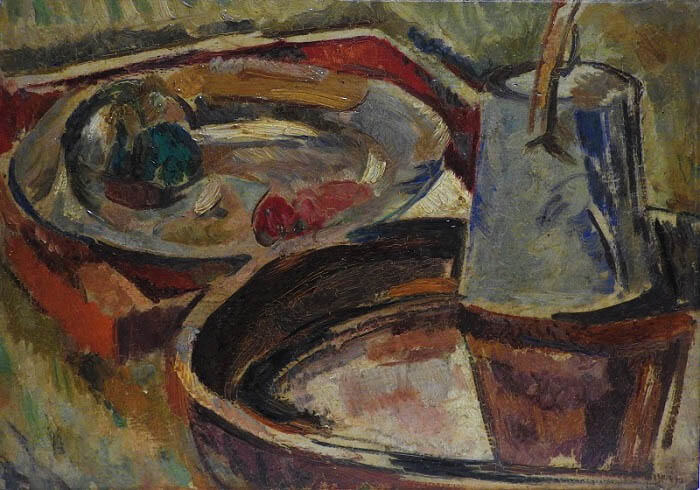
I want to click on plate, so click(x=68, y=207).